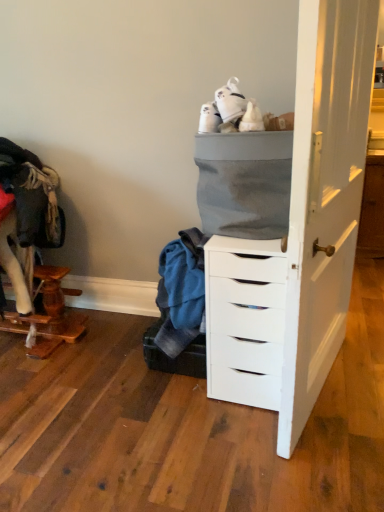
At what (x,y) coordinates should I click in order to perform the action: click on free location in front of white matte chest of drawers at center. Please return your answer as a coordinate pair (x, y). Image resolution: width=384 pixels, height=512 pixels. Looking at the image, I should click on (263, 441).